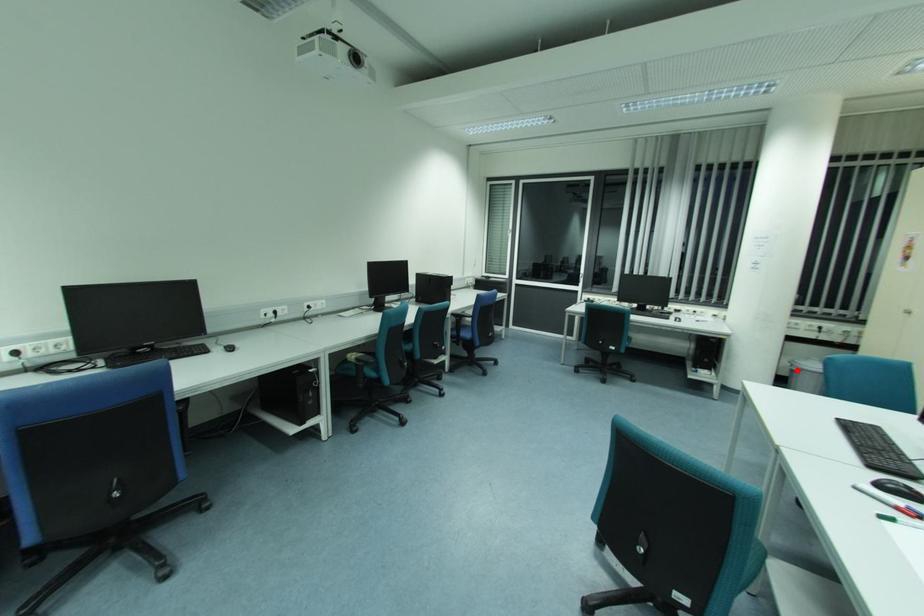
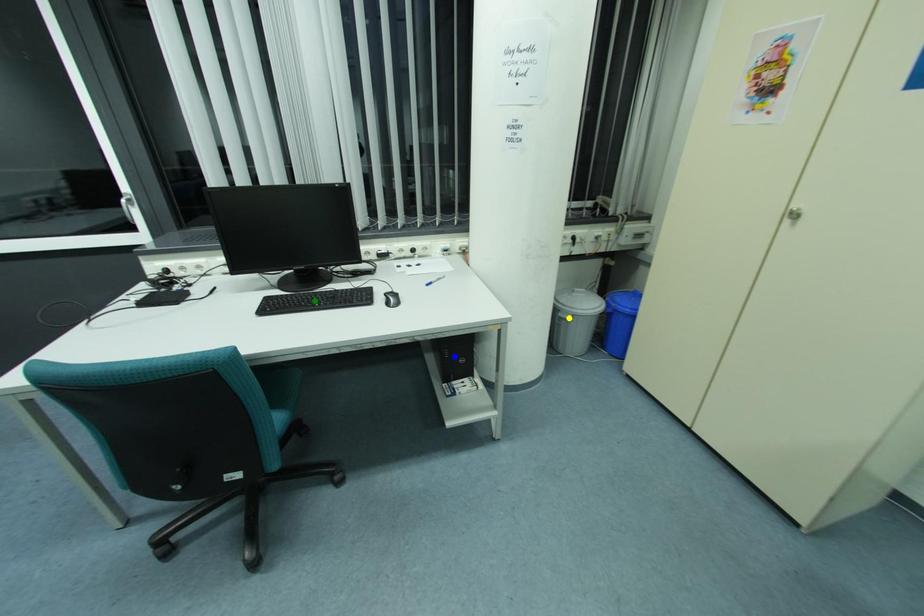
Question: I am providing you with two images of the same scene from different viewpoints. A red point is marked on the first image. You are given multiple points on the second image. Which mark in image 2 goes with the point in image 1?

Choices:
 (A) yellow point
 (B) blue point
 (C) green point

Answer: (A)